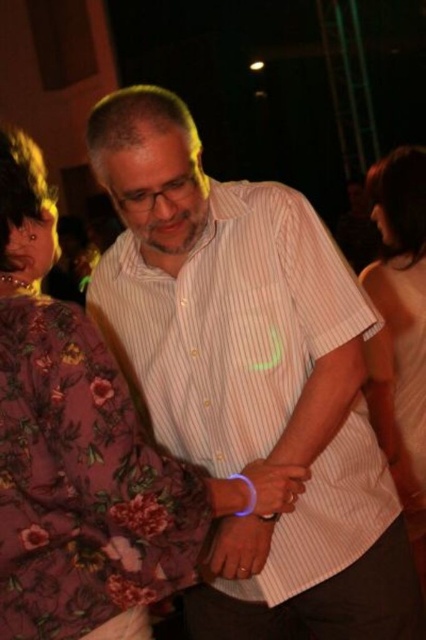
Question: Does white striped shirt at center come in front of white matte tank top at upper right?

Choices:
 (A) no
 (B) yes

Answer: (B)

Question: Is white striped shirt at center in front of white matte tank top at upper right?

Choices:
 (A) yes
 (B) no

Answer: (A)

Question: In this image, where is white striped shirt at center located relative to white matte tank top at upper right?

Choices:
 (A) above
 (B) below

Answer: (A)